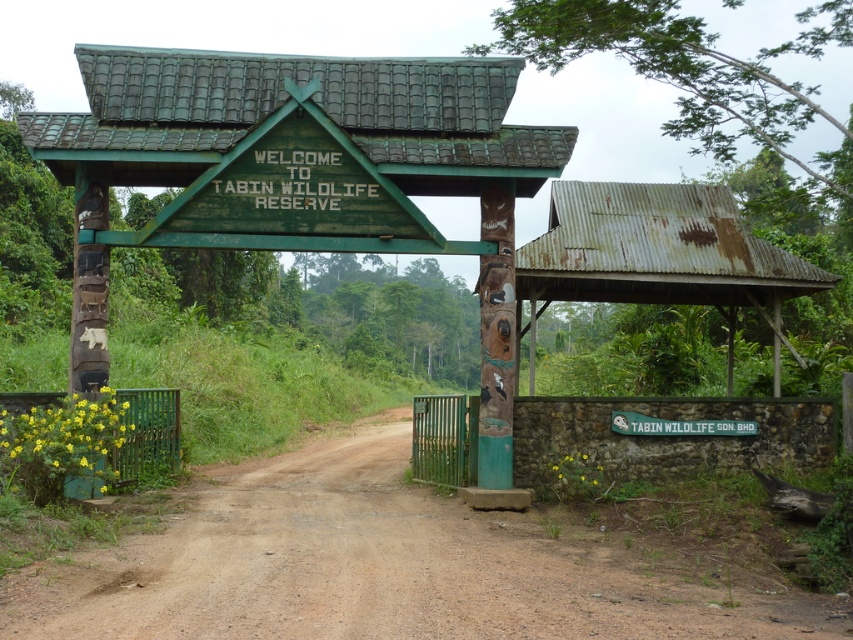
Looking at this image, you are standing at the entrance of Tabin Wildlife Reserve and want to take a photo. There are two points marked in the image, point A at coordinates point (525, 246) and point B at coordinates point (747, 422). Which point is closer to your camera when taking the photo?

Point A at coordinates point (525, 246) is closer to the camera than point B at coordinates point (747, 422) because it is further to the camera according to the description.

Based on the photo, you are standing at the entrance of Tabin Wildlife Reserve and want to locate the rusty corrugated metal hut at right. According to the coordinates provided, where exactly is it positioned?

The rusty corrugated metal hut at right is positioned at point (657, 252).

You are a park ranger driving a 5.5 meter long vehicle through the entrance of Tabin Wildlife Reserve. You need to park your vehicle between the brown dirt track at center and the rusty corrugated metal hut at center. Is there enough space for your vehicle to fit between them?

The distance between the brown dirt track at center and the rusty corrugated metal hut at center is 4.99 meters. Since your vehicle is 5.5 meters long, there isn not enough space to park it between them.